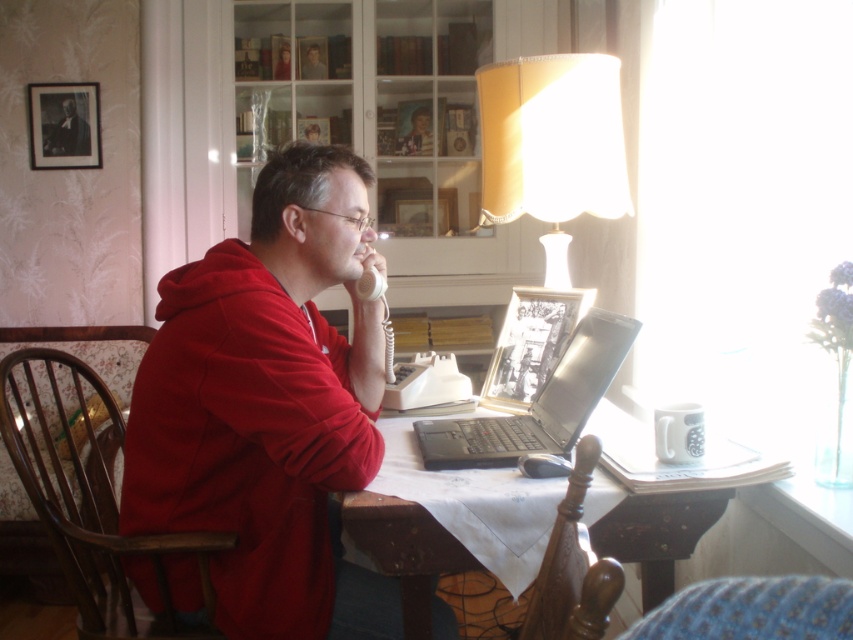
You are an interior designer assessing the lighting in this room. The yellow fabric lampshade at upper right and the smooth red hoodie at center are both in your line of sight. Which object is positioned higher relative to the other?

The yellow fabric lampshade at upper right is taller than the smooth red hoodie at center, so it is positioned higher.